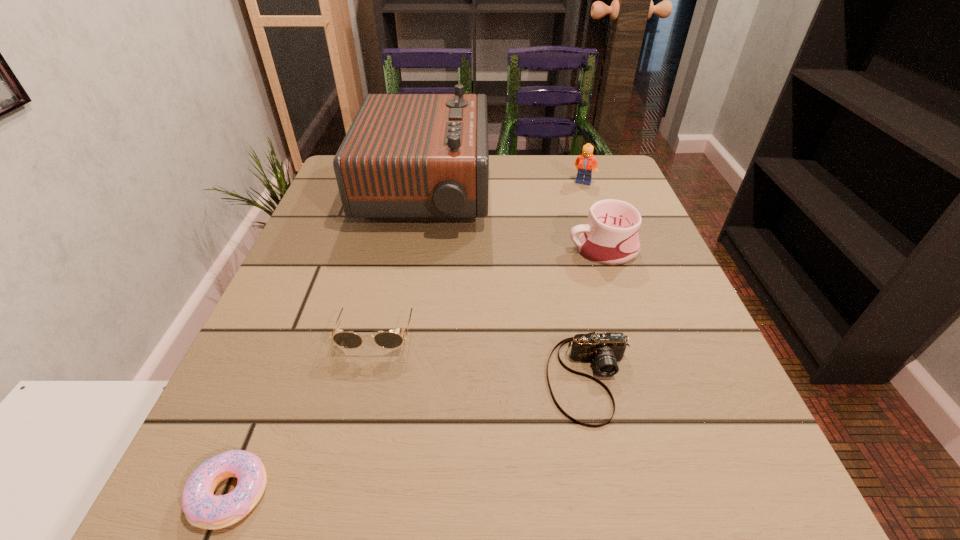
Image resolution: width=960 pixels, height=540 pixels. In order to click on doughnut present at the left edge in this screenshot , I will do click(x=202, y=509).

This screenshot has width=960, height=540. Identify the location of Lego at the right edge. (586, 162).

Image resolution: width=960 pixels, height=540 pixels. I want to click on mug located at the right edge, so click(x=610, y=236).

You are a GUI agent. You are given a task and a screenshot of the screen. Output one action in this format:
    pyautogui.click(x=<x>, y=<y>)
    Task: Click on the camera positioned at the right edge
    This screenshot has height=540, width=960.
    Given the screenshot: What is the action you would take?
    pyautogui.click(x=605, y=349)

At what (x,y) coordinates should I click in order to perform the action: click on object present at the far left corner. Please return your answer as a coordinate pair (x, y). Looking at the image, I should click on (406, 157).

Where is `object located at the near left corner`? object located at the near left corner is located at coordinates (202, 509).

Where is `object situated at the far right corner`? The width and height of the screenshot is (960, 540). object situated at the far right corner is located at coordinates (586, 162).

The image size is (960, 540). Find the location of `free point at the far edge`. free point at the far edge is located at coordinates (512, 172).

Find the location of `free space at the near edge`. free space at the near edge is located at coordinates (589, 488).

Where is `free spot at the left edge of the desktop`? This screenshot has height=540, width=960. free spot at the left edge of the desktop is located at coordinates (260, 326).